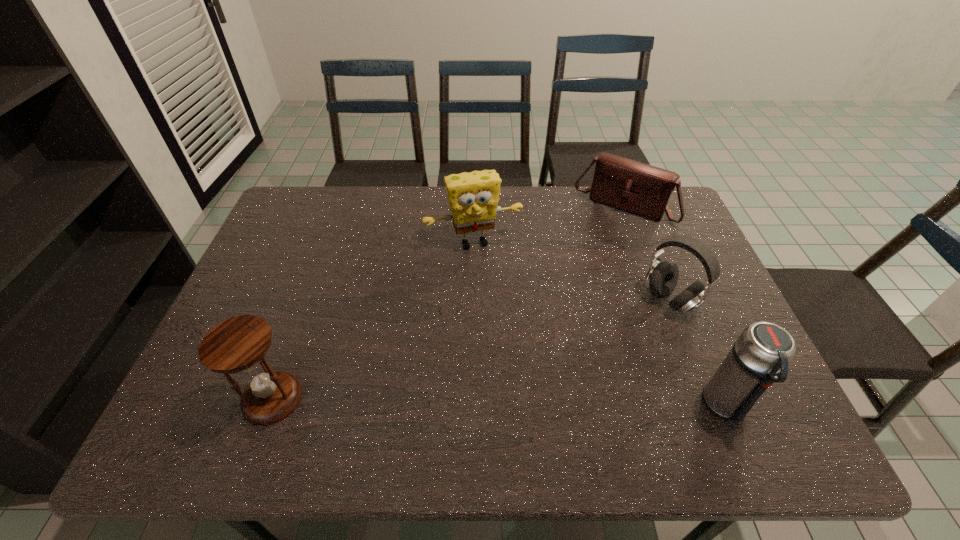
This screenshot has width=960, height=540. What are the coordinates of `the leftmost object` in the screenshot? It's located at (238, 344).

Where is `thermos bottle`? The image size is (960, 540). thermos bottle is located at coordinates (760, 356).

The width and height of the screenshot is (960, 540). What are the coordinates of `the third nearest object` in the screenshot? It's located at (662, 277).

I want to click on shoulder bag, so click(x=637, y=188).

Find the location of a particular element. Image resolution: width=960 pixels, height=540 pixels. the second object from left to right is located at coordinates (473, 197).

You are a GUI agent. You are given a task and a screenshot of the screen. Output one action in this format:
    pyautogui.click(x=<x>, y=<y>)
    Task: Click on the vacant space situated 0.280m on the right of the hourglass
    This screenshot has height=540, width=960.
    Given the screenshot: What is the action you would take?
    pyautogui.click(x=426, y=399)

Locate an element on the screen. The image size is (960, 540). free space located 0.090m on the ear cups of the third nearest object is located at coordinates (628, 328).

Identify the location of vacant space located on the ear cups of the third nearest object. This screenshot has height=540, width=960. (575, 361).

This screenshot has width=960, height=540. What are the coordinates of `free space located on the ear cups of the third nearest object` in the screenshot? It's located at 634,325.

At what (x,y) coordinates should I click in order to perform the action: click on vacant space situated 0.170m on the front flap of the shoulder bag. Please return your answer as a coordinate pair (x, y). Image resolution: width=960 pixels, height=540 pixels. Looking at the image, I should click on (587, 258).